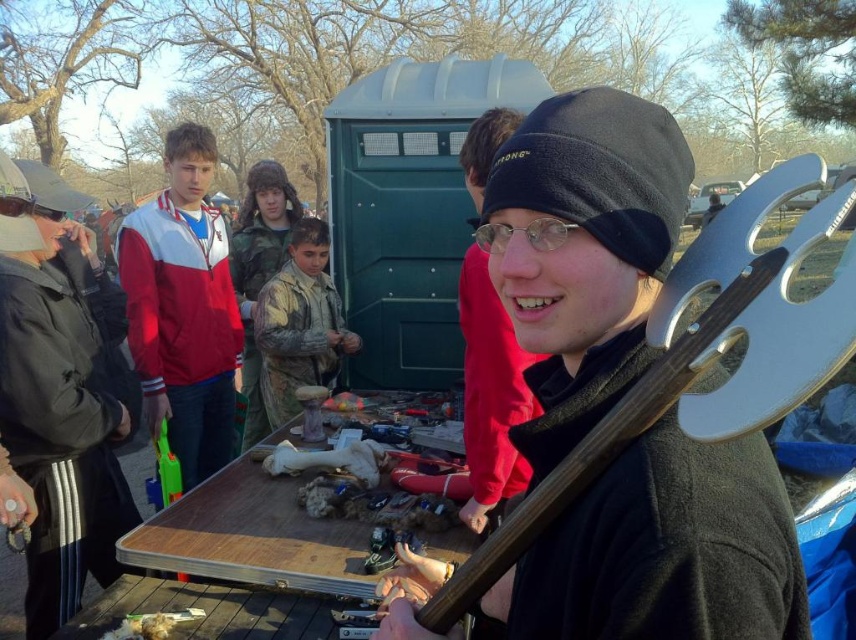
Is point (248, 529) positioned after point (474, 122)?

No, (248, 529) is in front of (474, 122).

The height and width of the screenshot is (640, 856). I want to click on wooden table at center, so click(x=253, y=536).

The width and height of the screenshot is (856, 640). In order to click on wooden table at center in this screenshot , I will do `click(253, 536)`.

Does point (476, 486) lie in front of point (324, 253)?

Yes, it is in front of point (324, 253).

Can you confirm if matte black beanie at upper center is smaller than camouflage fabric boy at center?

Correct, matte black beanie at upper center occupies less space than camouflage fabric boy at center.

Is point (488, 387) positioned in front of point (330, 301)?

Yes, it is in front of point (330, 301).

I want to click on matte black beanie at upper center, so click(490, 394).

Between wooden table at center and camouflage fabric boy at center, which one has less height?

wooden table at center

Is wooden table at center to the right of camouflage fabric boy at center from the viewer's perspective?

Yes, wooden table at center is to the right of camouflage fabric boy at center.

Does point (290, 481) lie in front of point (337, 342)?

Yes, point (290, 481) is in front of point (337, 342).

The image size is (856, 640). Find the location of `wooden table at center`. wooden table at center is located at coordinates (253, 536).